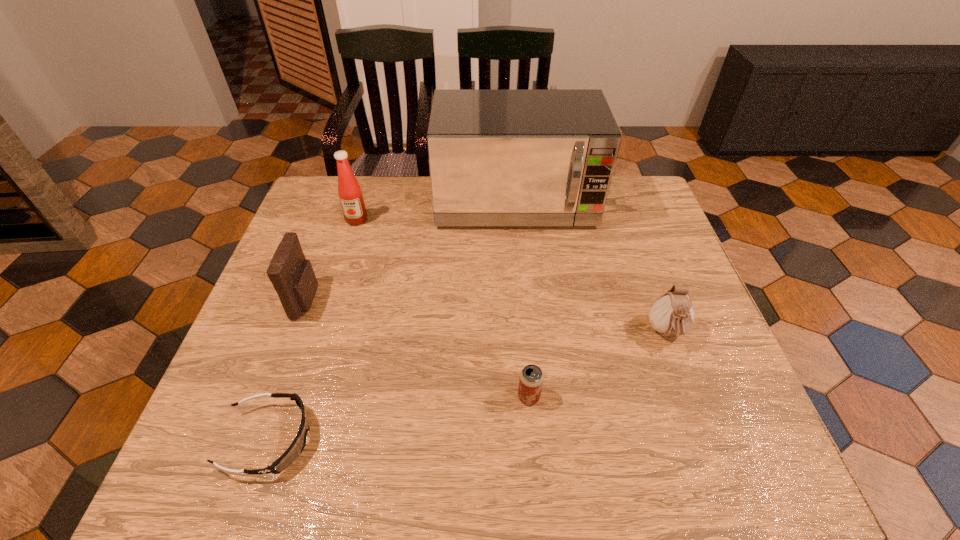
What are the coordinates of `object that is at the right edge` in the screenshot? It's located at (672, 314).

You are a GUI agent. You are given a task and a screenshot of the screen. Output one action in this format:
    pyautogui.click(x=<x>, y=<y>)
    Task: Click on the object situated at the far left corner
    
    Given the screenshot: What is the action you would take?
    pyautogui.click(x=349, y=191)

This screenshot has width=960, height=540. Identify the location of object that is at the near left corner. (295, 449).

You are a GUI agent. You are given a task and a screenshot of the screen. Output one action in this format:
    pyautogui.click(x=<x>, y=<y>)
    Task: Click on the vacant space at the far edge of the desktop
    Image resolution: width=960 pixels, height=540 pixels.
    Given the screenshot: What is the action you would take?
    pyautogui.click(x=372, y=187)

Image resolution: width=960 pixels, height=540 pixels. Find the location of `vacant space at the left edge of the desktop`. vacant space at the left edge of the desktop is located at coordinates (312, 231).

In the image, there is a desktop. Where is `vacant space at the right edge`? This screenshot has width=960, height=540. vacant space at the right edge is located at coordinates (647, 235).

The image size is (960, 540). I want to click on blank area at the near left corner, so click(190, 458).

At what (x,y) coordinates should I click in order to perform the action: click on vacant point located between the microwave oven and the goggles. Please return your answer as a coordinate pair (x, y). Looking at the image, I should click on (393, 321).

This screenshot has height=540, width=960. In order to click on empty space between the fifth shortest object and the left pouch in this screenshot , I will do `click(332, 260)`.

This screenshot has height=540, width=960. Find the location of `vacant area that lies between the fifth shortest object and the beer can`. vacant area that lies between the fifth shortest object and the beer can is located at coordinates (443, 308).